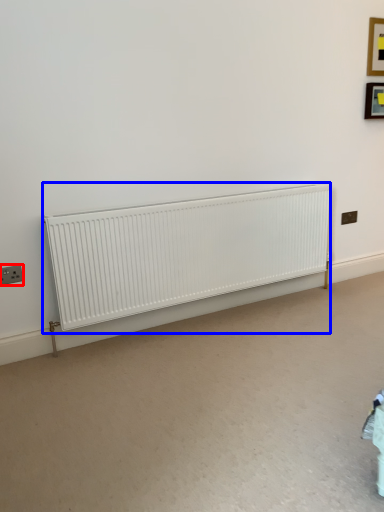
Question: Among these objects, which one is nearest to the camera, electric outlet (highlighted by a red box) or radiator (highlighted by a blue box)?

Choices:
 (A) electric outlet
 (B) radiator

Answer: (B)